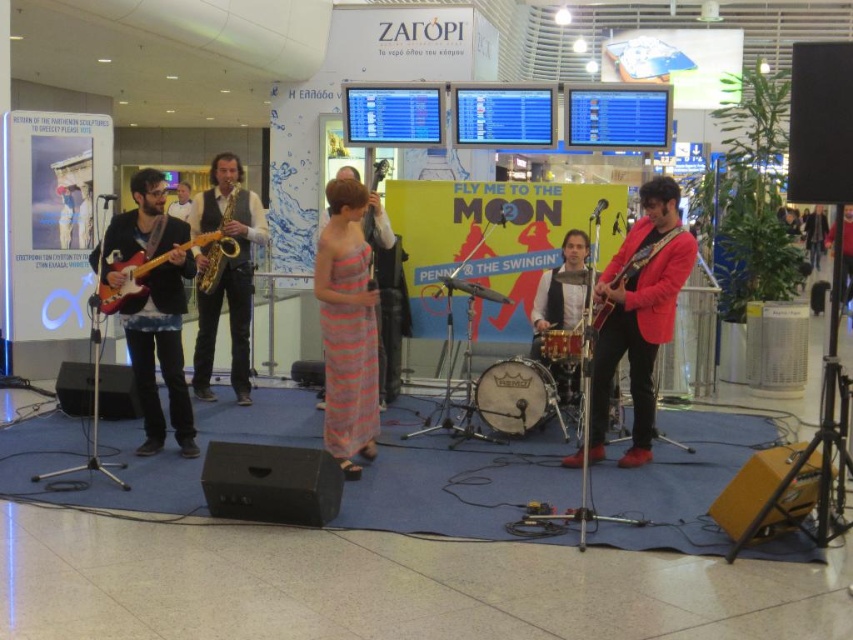
Question: Does shiny red blazer at center lie in front of shiny red guitar at center?

Choices:
 (A) no
 (B) yes

Answer: (B)

Question: Which point is closer to the camera taking this photo?

Choices:
 (A) (352, 314)
 (B) (122, 273)

Answer: (A)

Question: Does gold shiny saxophone at left have a lesser width compared to matte black guitar at center?

Choices:
 (A) yes
 (B) no

Answer: (B)

Question: Does matte black guitar at left appear on the left side of gold shiny saxophone at left?

Choices:
 (A) no
 (B) yes

Answer: (B)

Question: Which object appears closest to the camera in this image?

Choices:
 (A) shiny red blazer at center
 (B) matte black guitar at center
 (C) gold shiny saxophone at left

Answer: (A)

Question: Based on their relative distances, which object is nearer to the matte wood electric guitar at left?

Choices:
 (A) matte black guitar at left
 (B) shiny red blazer at center

Answer: (A)